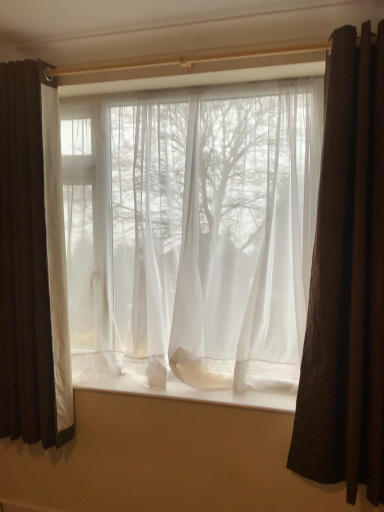
Question: Does brown velvet curtain at right, which is counted as the first curtain, starting from the right, have a larger size compared to matte white curtain at left, the 3th curtain positioned from the right?

Choices:
 (A) no
 (B) yes

Answer: (A)

Question: Is the surface of brown velvet curtain at right, positioned as the third curtain in left-to-right order, in direct contact with matte white curtain at left, positioned as the first curtain in left-to-right order?

Choices:
 (A) no
 (B) yes

Answer: (A)

Question: Are brown velvet curtain at right, positioned as the third curtain in left-to-right order, and matte white curtain at left, positioned as the first curtain in left-to-right order, located far from each other?

Choices:
 (A) no
 (B) yes

Answer: (B)

Question: Does brown velvet curtain at right, which is counted as the first curtain, starting from the right, lie behind matte white curtain at left, the 3th curtain positioned from the right?

Choices:
 (A) yes
 (B) no

Answer: (B)

Question: From the image's perspective, is brown velvet curtain at right, which is counted as the first curtain, starting from the right, located beneath matte white curtain at left, positioned as the first curtain in left-to-right order?

Choices:
 (A) no
 (B) yes

Answer: (B)

Question: Can you confirm if brown velvet curtain at right, positioned as the third curtain in left-to-right order, is shorter than matte white curtain at left, positioned as the first curtain in left-to-right order?

Choices:
 (A) yes
 (B) no

Answer: (B)

Question: Is sheer white curtain at center, which ranks as the 2th curtain in left-to-right order, at the left side of matte white curtain at left, the 3th curtain positioned from the right?

Choices:
 (A) no
 (B) yes

Answer: (A)

Question: Can you confirm if sheer white curtain at center, which ranks as the 2th curtain in left-to-right order, is thinner than matte white curtain at left, the 3th curtain positioned from the right?

Choices:
 (A) no
 (B) yes

Answer: (A)

Question: Is sheer white curtain at center, placed as the second curtain when sorted from right to left, oriented away from matte white curtain at left, the 3th curtain positioned from the right?

Choices:
 (A) no
 (B) yes

Answer: (A)

Question: Is sheer white curtain at center, placed as the second curtain when sorted from right to left, positioned before matte white curtain at left, the 3th curtain positioned from the right?

Choices:
 (A) yes
 (B) no

Answer: (A)

Question: Can you confirm if sheer white curtain at center, which ranks as the 2th curtain in left-to-right order, is positioned to the right of matte white curtain at left, positioned as the first curtain in left-to-right order?

Choices:
 (A) yes
 (B) no

Answer: (A)

Question: From the image's perspective, is sheer white curtain at center, placed as the second curtain when sorted from right to left, located above matte white curtain at left, positioned as the first curtain in left-to-right order?

Choices:
 (A) yes
 (B) no

Answer: (A)

Question: Is matte white curtain at left, positioned as the first curtain in left-to-right order, surrounding brown velvet curtain at right, which is counted as the first curtain, starting from the right?

Choices:
 (A) yes
 (B) no

Answer: (B)